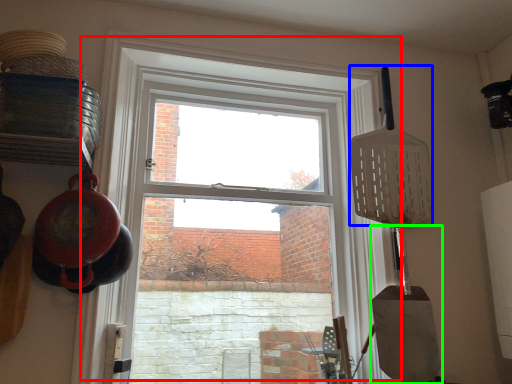
Question: Which object is positioned closest to window (highlighted by a red box)? Select from spatula (highlighted by a blue box) and shovel (highlighted by a green box).

Choices:
 (A) spatula
 (B) shovel

Answer: (A)